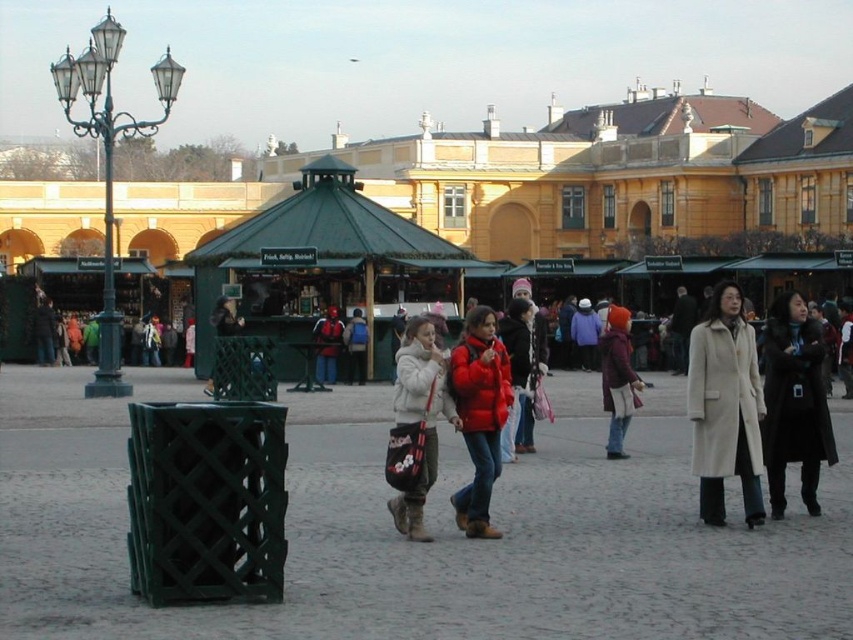
Who is more forward, (744, 401) or (781, 509)?

Point (744, 401)

Is point (722, 426) positioned behind point (802, 316)?

That is False.

Find the location of `beige wool coat at center`. beige wool coat at center is located at coordinates (724, 406).

Does black wool coat at center-right lie behind white fuzzy coat at center?

Yes, black wool coat at center-right is behind white fuzzy coat at center.

Does black wool coat at center-right have a smaller size compared to white fuzzy coat at center?

Yes.

Does point (801, 364) come behind point (425, 326)?

Yes, it is.

This screenshot has width=853, height=640. What are the coordinates of `black wool coat at center-right` in the screenshot? It's located at (793, 403).

Between point (215, 342) and point (782, 493), which one is positioned behind?

The point (215, 342) is behind.

The width and height of the screenshot is (853, 640). Describe the element at coordinates (325, 266) in the screenshot. I see `green wooden gazebo at center` at that location.

Describe the element at coordinates (325, 266) in the screenshot. I see `green wooden gazebo at center` at that location.

Locate an element on the screen. green wooden gazebo at center is located at coordinates (325, 266).